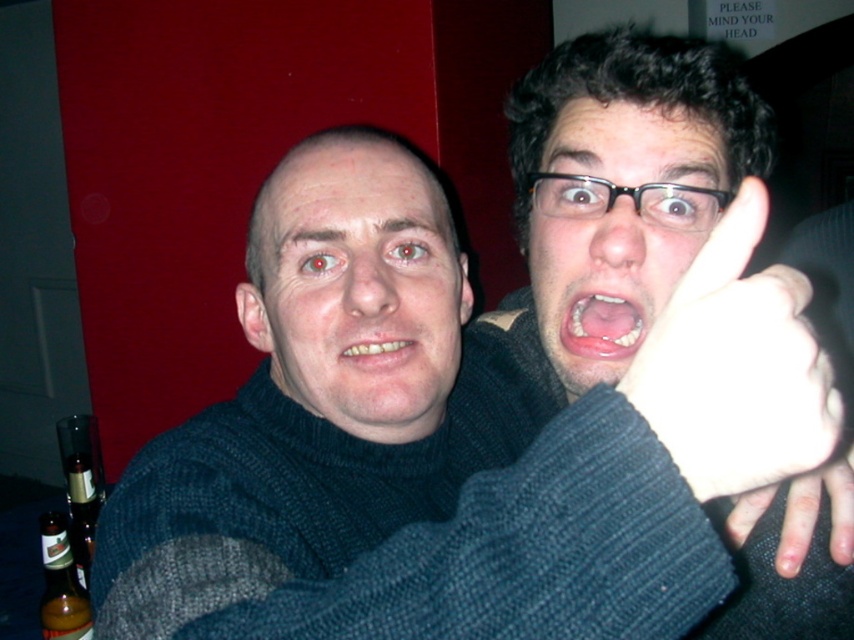
You are a photographer adjusting the lighting for a portrait. You notice the pink glossy lips at center and the amber glass bottle at lower left are 36.27 inches apart. To ensure both subjects are well lit, you need to position your light source equidistant from both. What is the minimum distance you should place the light from each subject?

The light source should be placed at a midpoint between the pink glossy lips at center and the amber glass bottle at lower left, which would be 18.135 inches away from each subject to ensure equal illumination.

You are a photographer adjusting the lighting in the studio. You notice the matte black glasses at upper right and the smooth skin hand at center. Which object should you focus on first if you want to adjust the lighting for the closer subject?

The matte black glasses at upper right is closer to the viewer than the smooth skin hand at center, so you should focus on the matte black glasses at upper right first.